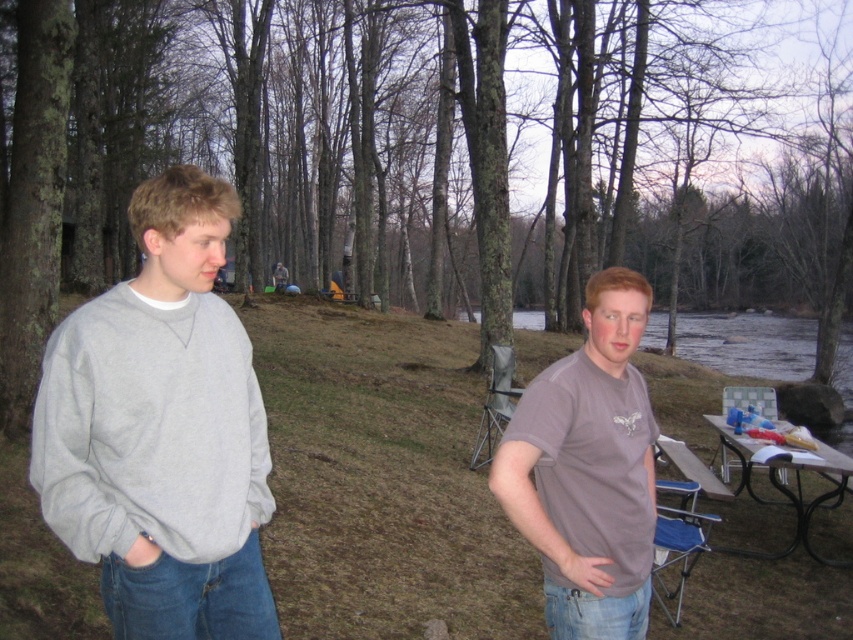
Is point (161, 348) positioned in front of point (747, 476)?

Yes, point (161, 348) is in front of point (747, 476).

Does gray heathered sweatshirt at left appear under metallic silver picnic table at lower right?

No, gray heathered sweatshirt at left is not below metallic silver picnic table at lower right.

Find the location of a particular element. The width and height of the screenshot is (853, 640). gray heathered sweatshirt at left is located at coordinates (161, 429).

Locate an element on the screen. Image resolution: width=853 pixels, height=640 pixels. gray heathered sweatshirt at left is located at coordinates (161, 429).

Does point (566, 570) come behind point (753, 552)?

No, (566, 570) is closer to viewer.

Does matte gray t-shirt at center appear on the right side of metallic silver picnic table at lower right?

In fact, matte gray t-shirt at center is to the left of metallic silver picnic table at lower right.

The height and width of the screenshot is (640, 853). What are the coordinates of `matte gray t-shirt at center` in the screenshot? It's located at (589, 470).

Where is `matte gray t-shirt at center`? This screenshot has width=853, height=640. matte gray t-shirt at center is located at coordinates (589, 470).

Does gray heathered sweatshirt at left appear under matte gray t-shirt at center?

No.

In order to click on gray heathered sweatshirt at left in this screenshot , I will do `click(161, 429)`.

You are a GUI agent. You are given a task and a screenshot of the screen. Output one action in this format:
    pyautogui.click(x=<x>, y=<y>)
    Task: Click on the gray heathered sweatshirt at left
    This screenshot has height=640, width=853.
    Given the screenshot: What is the action you would take?
    pyautogui.click(x=161, y=429)